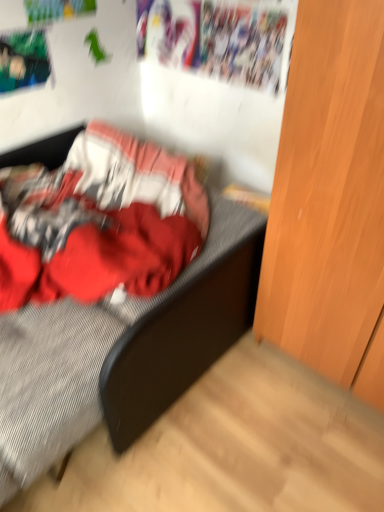
Question: From a real-world perspective, is light brown wood dresser at right physically located above or below textured gray bed at center?

Choices:
 (A) below
 (B) above

Answer: (B)

Question: Which is correct: light brown wood dresser at right is inside textured gray bed at center, or outside of it?

Choices:
 (A) outside
 (B) inside

Answer: (A)

Question: Looking at their shapes, would you say light brown wood dresser at right is wider or thinner than textured gray bed at center?

Choices:
 (A) thin
 (B) wide

Answer: (A)

Question: Looking at the image, does textured gray bed at center seem bigger or smaller compared to light brown wood dresser at right?

Choices:
 (A) small
 (B) big

Answer: (B)

Question: From the image's perspective, is textured gray bed at center located above or below light brown wood dresser at right?

Choices:
 (A) above
 (B) below

Answer: (B)

Question: Which is correct: textured gray bed at center is inside light brown wood dresser at right, or outside of it?

Choices:
 (A) outside
 (B) inside

Answer: (A)

Question: Considering their positions, is textured gray bed at center located in front of or behind light brown wood dresser at right?

Choices:
 (A) behind
 (B) front

Answer: (A)